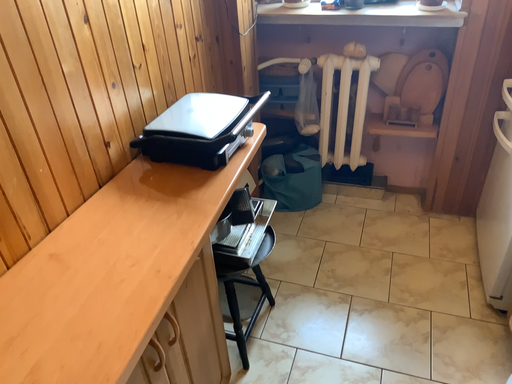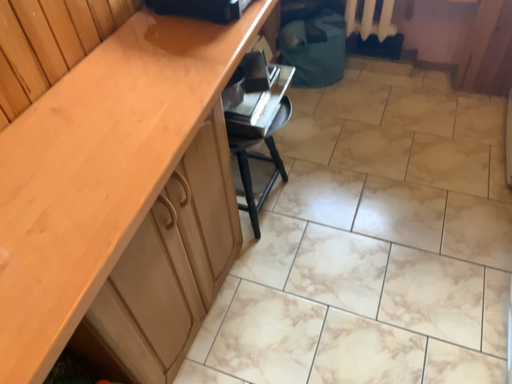
Question: How did the camera likely rotate when shooting the video?

Choices:
 (A) rotated upward
 (B) rotated downward

Answer: (B)